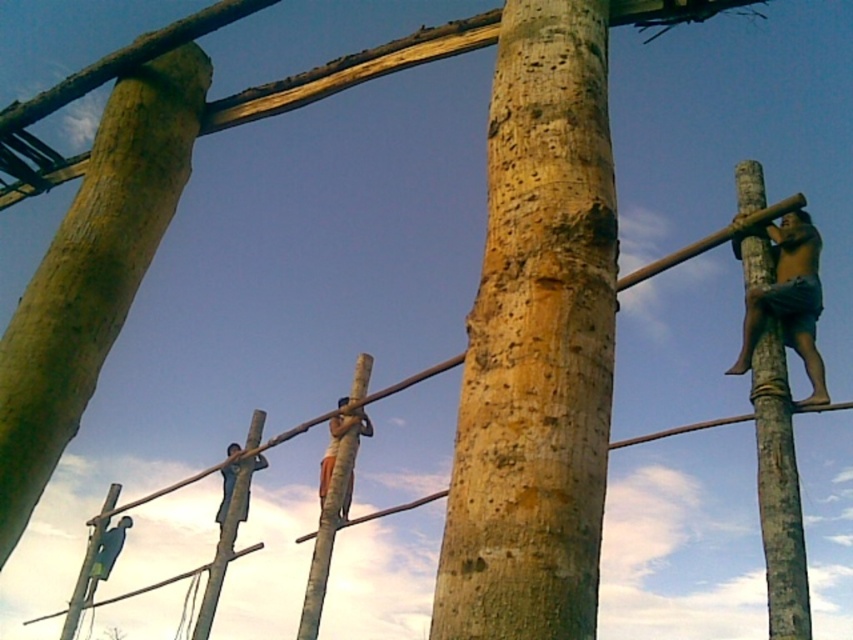
Is point (779, 621) farther from camera compared to point (347, 484)?

No, it is in front of (347, 484).

What do you see at coordinates (778, 490) in the screenshot? The width and height of the screenshot is (853, 640). I see `smooth brown pole at right` at bounding box center [778, 490].

Who is more distant from viewer, (756, 368) or (341, 419)?

The point (341, 419) is behind.

Locate an element on the screen. Image resolution: width=853 pixels, height=640 pixels. smooth brown pole at right is located at coordinates (778, 490).

Between point (590, 474) and point (222, 524), which one is positioned behind?

Positioned behind is point (222, 524).

Does natural wood pole at center appear on the left side of wooden pole at center?

No, natural wood pole at center is not to the left of wooden pole at center.

Where is `natural wood pole at center`? This screenshot has width=853, height=640. natural wood pole at center is located at coordinates (537, 342).

At what (x,y) coordinates should I click in order to perform the action: click on natural wood pole at center. Please return your answer as a coordinate pair (x, y). Looking at the image, I should click on (537, 342).

Is point (431, 637) behind point (366, 378)?

No, it is not.

The image size is (853, 640). In order to click on natural wood pole at center in this screenshot , I will do `click(537, 342)`.

Locate an element on the screen. natural wood pole at center is located at coordinates (537, 342).